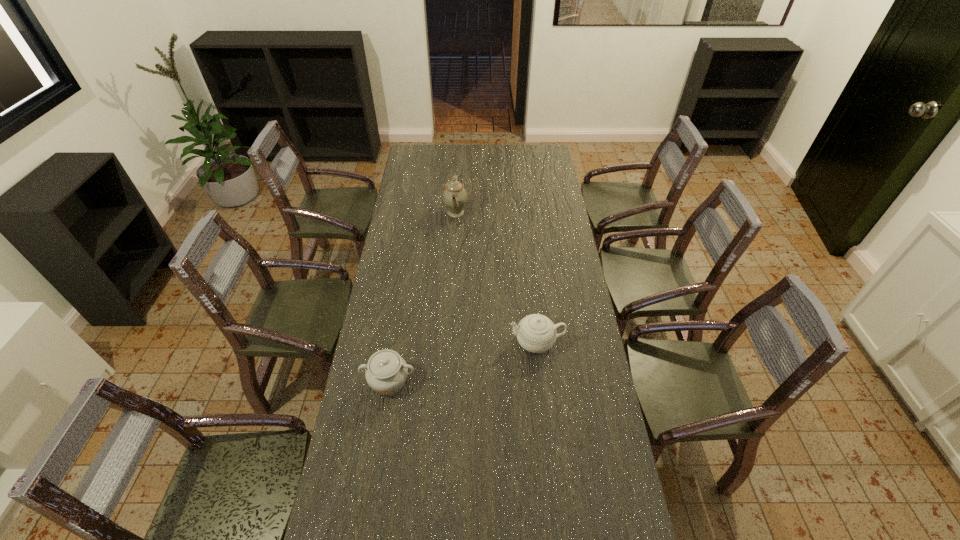
The width and height of the screenshot is (960, 540). I want to click on free space located 0.320m on the right of the nearest chinaware, so click(x=511, y=382).

I want to click on object that is at the left edge, so click(x=386, y=373).

At what (x,y) coordinates should I click in order to perform the action: click on object that is at the right edge. Please return your answer as a coordinate pair (x, y). Image resolution: width=960 pixels, height=540 pixels. Looking at the image, I should click on (536, 333).

You are a GUI agent. You are given a task and a screenshot of the screen. Output one action in this format:
    pyautogui.click(x=<x>, y=<y>)
    Task: Click on the free spot at the far edge of the desktop
    
    Given the screenshot: What is the action you would take?
    pyautogui.click(x=456, y=145)

Locate an element on the screen. The image size is (960, 540). vacant area at the left edge of the desktop is located at coordinates (413, 167).

What are the coordinates of `vacant space at the right edge of the desktop` in the screenshot? It's located at [x=590, y=467].

In the image, there is a desktop. Identify the location of vacant space at the far left corner. (416, 151).

Locate an element on the screen. Image resolution: width=960 pixels, height=540 pixels. vacant space at the far right corner of the desktop is located at coordinates (542, 159).

Where is `vacant point located between the nearest object and the rightmost chinaware`? This screenshot has height=540, width=960. vacant point located between the nearest object and the rightmost chinaware is located at coordinates (463, 362).

Where is `empty space that is in between the second farthest chinaware and the tallest chinaware`? The height and width of the screenshot is (540, 960). empty space that is in between the second farthest chinaware and the tallest chinaware is located at coordinates (496, 278).